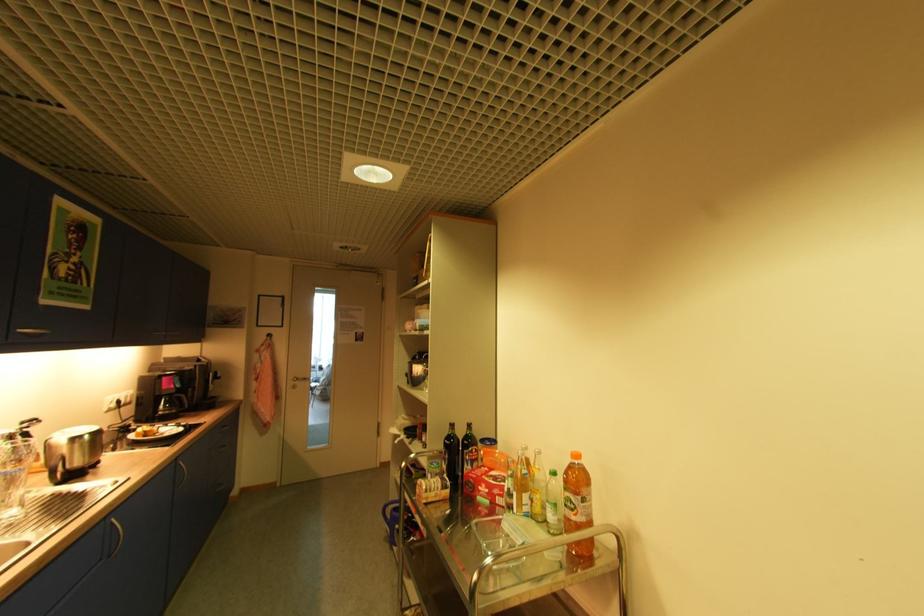
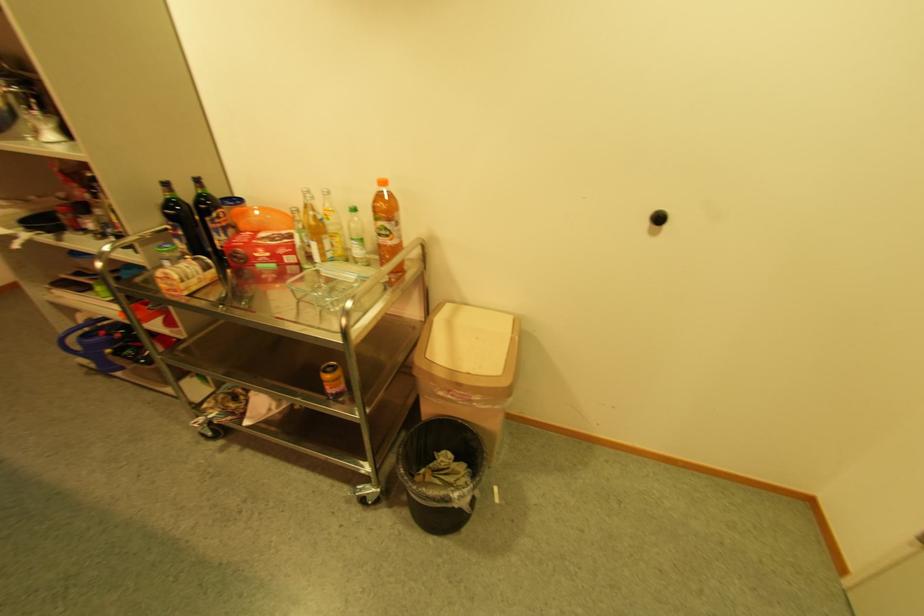
Locate, in the second image, the point that corresponds to (451,445) in the first image.

(172, 217)